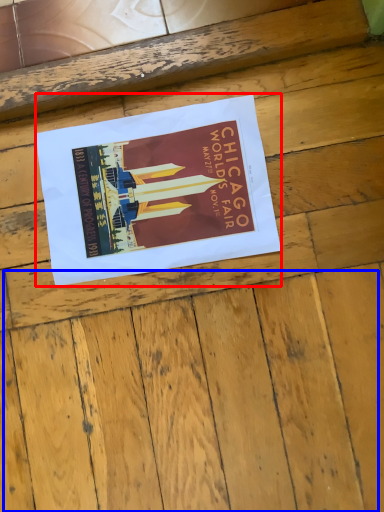
Question: Which object is closer to the camera taking this photo, poster (highlighted by a red box) or plywood (highlighted by a blue box)?

Choices:
 (A) poster
 (B) plywood

Answer: (B)